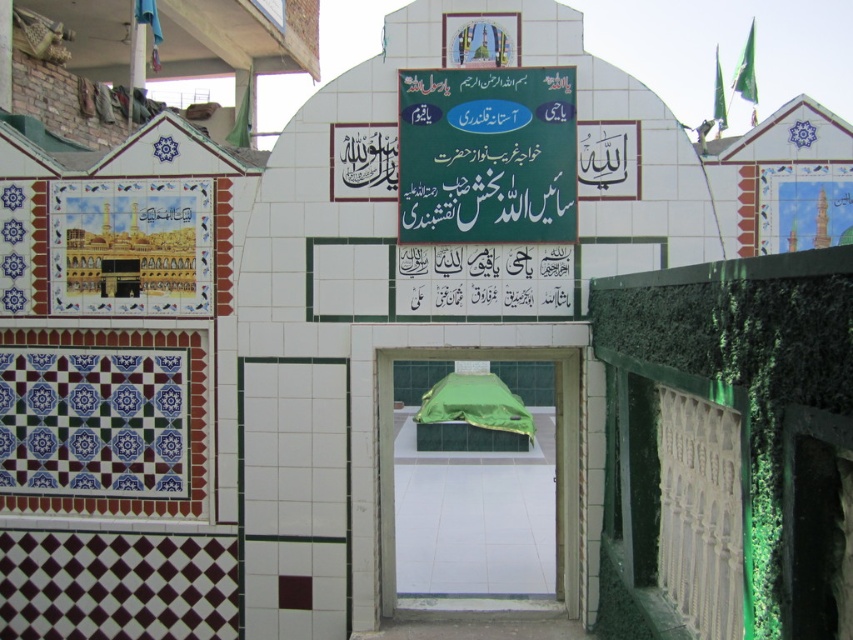
Question: Is green fabric sign at center thinner than green fabric-covered structure at center?

Choices:
 (A) no
 (B) yes

Answer: (B)

Question: Which point is closer to the camera?

Choices:
 (A) green fabric sign at center
 (B) green fabric-covered structure at center

Answer: (A)

Question: Which point is farther to the camera?

Choices:
 (A) (567, 72)
 (B) (387, 552)

Answer: (B)

Question: Can you confirm if green fabric sign at center is bigger than green fabric-covered structure at center?

Choices:
 (A) yes
 (B) no

Answer: (B)

Question: Which point is closer to the camera?

Choices:
 (A) green fabric sign at center
 (B) green fabric-covered structure at center

Answer: (A)

Question: Is green fabric sign at center below green fabric-covered structure at center?

Choices:
 (A) no
 (B) yes

Answer: (A)